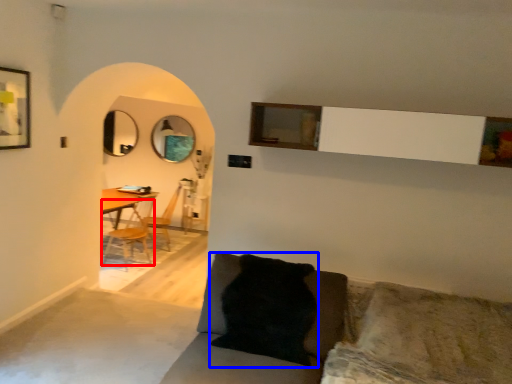
Question: Among these objects, which one is nearest to the camera, chair (highlighted by a red box) or pillow (highlighted by a blue box)?

Choices:
 (A) chair
 (B) pillow

Answer: (B)